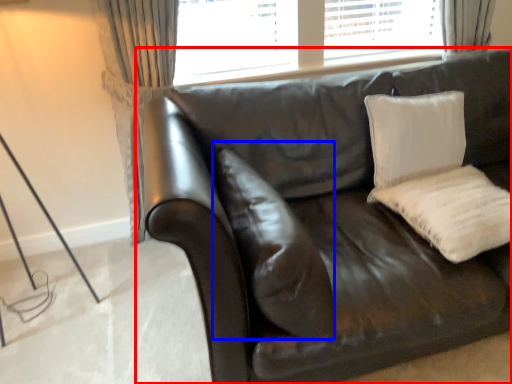
Question: Which of the following is the farthest to the observer, studio couch (highlighted by a red box) or pillow (highlighted by a blue box)?

Choices:
 (A) studio couch
 (B) pillow

Answer: (B)